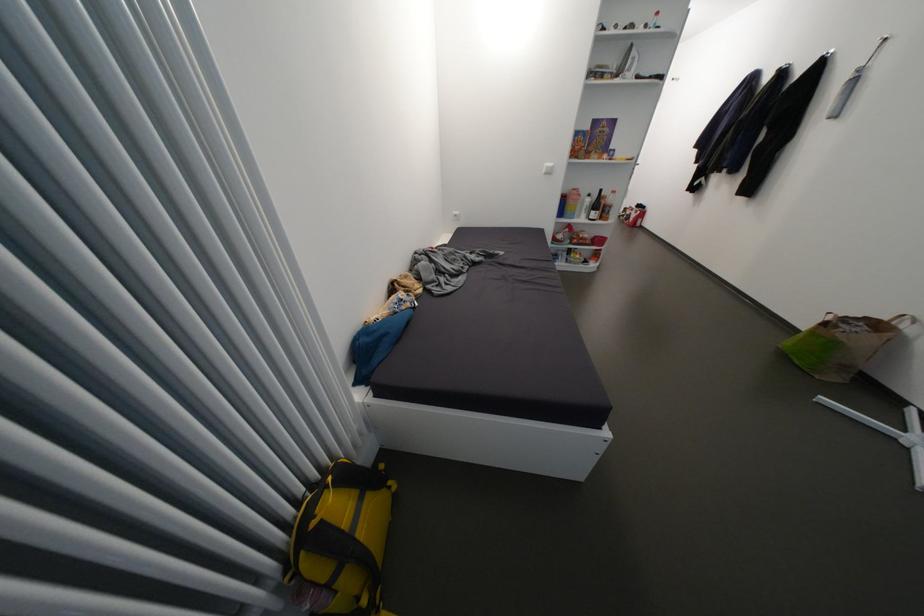
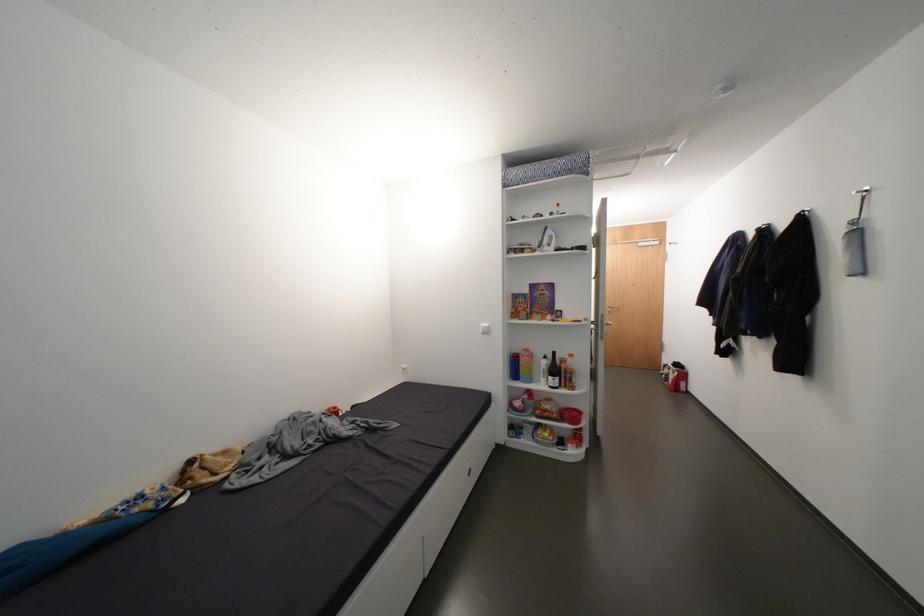
Where in the second image is the point corresponding to the point at 610,203 from the first image?

(570, 367)